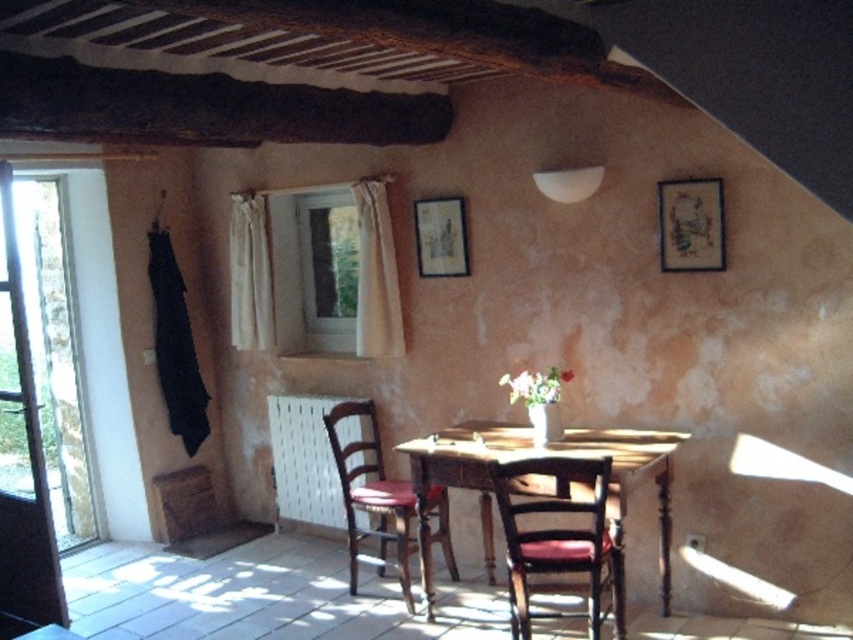
You are an interior designer planning to install a new fixture between the clear glass window at upper center and the wooden picture frame at upper center. Which object has a wider space available for placement?

The clear glass window at upper center has a wider space available for placement since its width is larger than the wooden picture frame at upper center.

You are standing in the dining area and want to place a small potted plant between the two points marked as point (595, 582) and point (677, 186). Since the plant is only 10 cm tall, which point should you position it closer to so that it remains visible from your current viewpoint?

You should position the plant closer to point (595, 582) because it is closer to the camera, ensuring the plant remains visible from your current viewpoint.